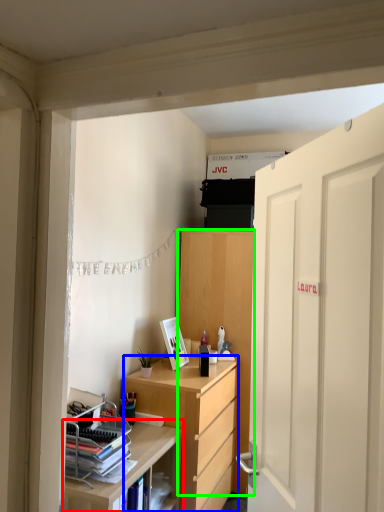
Question: Which is nearer to the shelf (highlighted by a red box)? desk (highlighted by a blue box) or cabinetry (highlighted by a green box).

Choices:
 (A) desk
 (B) cabinetry

Answer: (A)